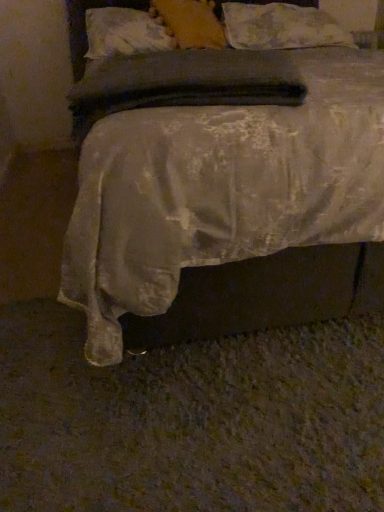
Question: Is soft yellow pillow at upper center, which is the 2th pillow in left-to-right order, to the left or to the right of silky white bed at center in the image?

Choices:
 (A) left
 (B) right

Answer: (A)

Question: In the image, is soft yellow pillow at upper center, placed as the 2th pillow when sorted from right to left, positioned in front of or behind silky white bed at center?

Choices:
 (A) front
 (B) behind

Answer: (B)

Question: Estimate the real-world distances between objects in this image. Which object is farther from the fluffy white pillow at upper center, which is the third pillow from left to right?

Choices:
 (A) white textured pillow at upper center, arranged as the first pillow when viewed from the left
 (B) silky white bed at center
 (C) soft yellow pillow at upper center, placed as the 2th pillow when sorted from right to left

Answer: (B)

Question: Which of these objects is positioned farthest from the fluffy white pillow at upper center, which is the third pillow from left to right?

Choices:
 (A) silky white bed at center
 (B) white textured pillow at upper center, which is counted as the third pillow, starting from the right
 (C) soft yellow pillow at upper center, which is the 2th pillow in left-to-right order

Answer: (A)